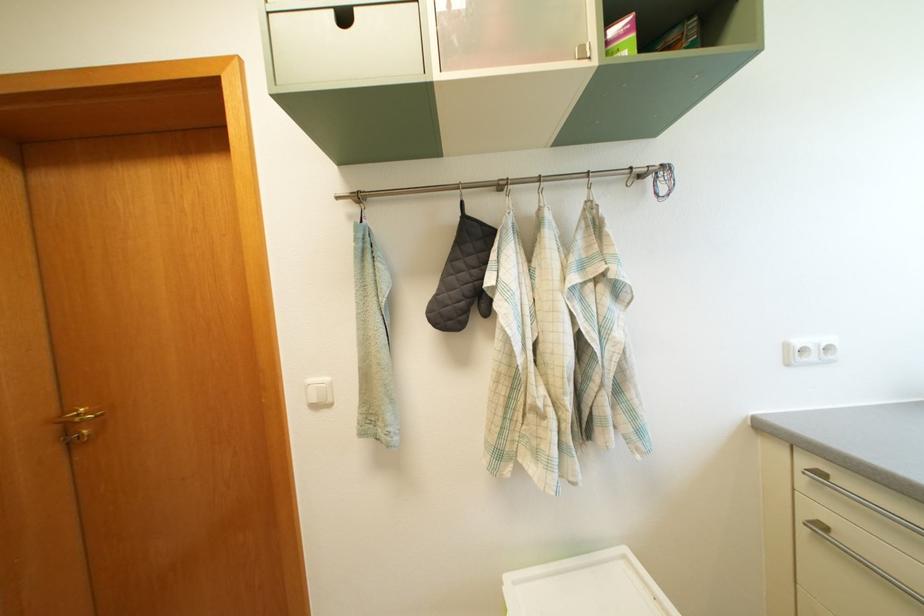
Find where to pull the gold door handle. Please return your answer as a coordinate pair (x, y).

(77, 418)